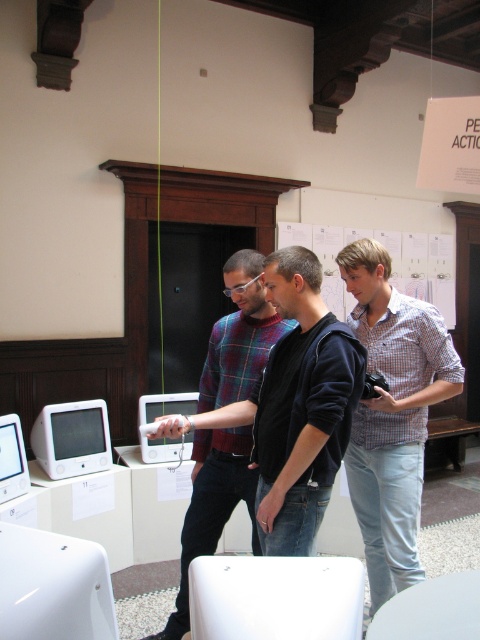
Can you confirm if white plastic monitor at lower left is positioned below white glossy computer at center?

Indeed, white plastic monitor at lower left is positioned under white glossy computer at center.

Does white plastic monitor at lower left have a lesser width compared to white glossy computer at center?

No.

Find the location of a particular element. white plastic monitor at lower left is located at coordinates (72, 438).

I want to click on white plastic monitor at lower left, so click(x=72, y=438).

Which is in front, point (78, 428) or point (24, 477)?

Point (24, 477)

Between white plastic monitor at lower left and white glossy monitor at left, which one is positioned lower?

white glossy monitor at left is lower down.

Is point (58, 419) closer to viewer compared to point (0, 422)?

No, it is behind (0, 422).

Locate an element on the screen. Image resolution: width=480 pixels, height=640 pixels. white plastic monitor at lower left is located at coordinates (72, 438).

Which is in front, point (405, 387) or point (144, 410)?

Positioned in front is point (405, 387).

Where is `light blue jeans at center`? The image size is (480, 640). light blue jeans at center is located at coordinates (393, 413).